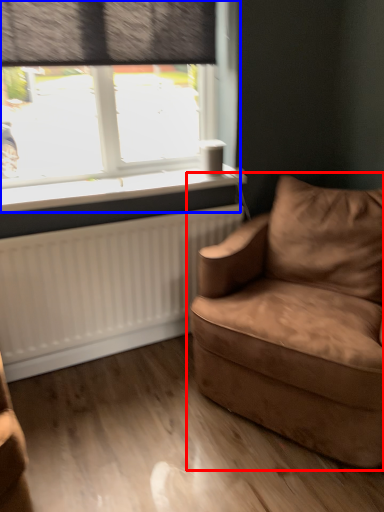
Question: Which point is further to the camera, studio couch (highlighted by a red box) or window (highlighted by a blue box)?

Choices:
 (A) studio couch
 (B) window

Answer: (B)